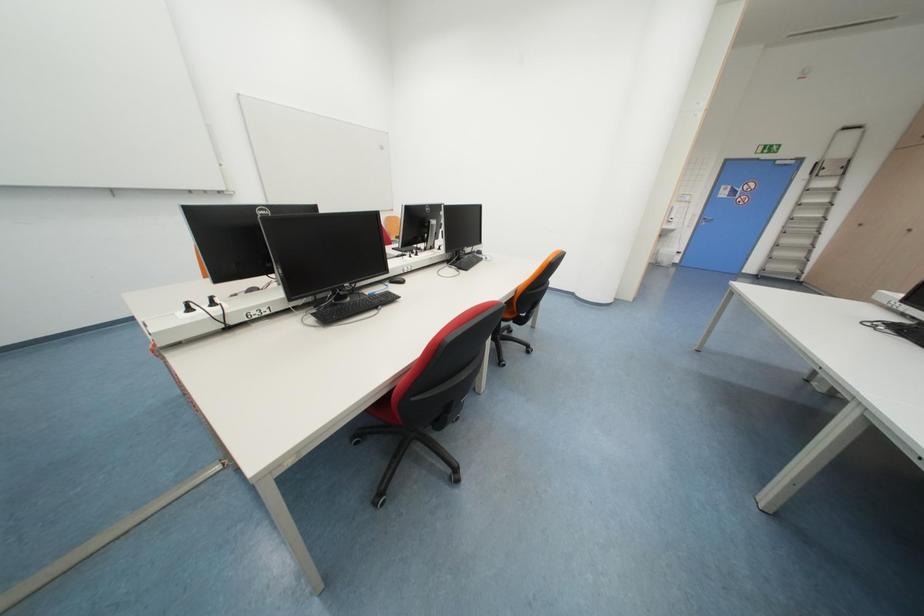
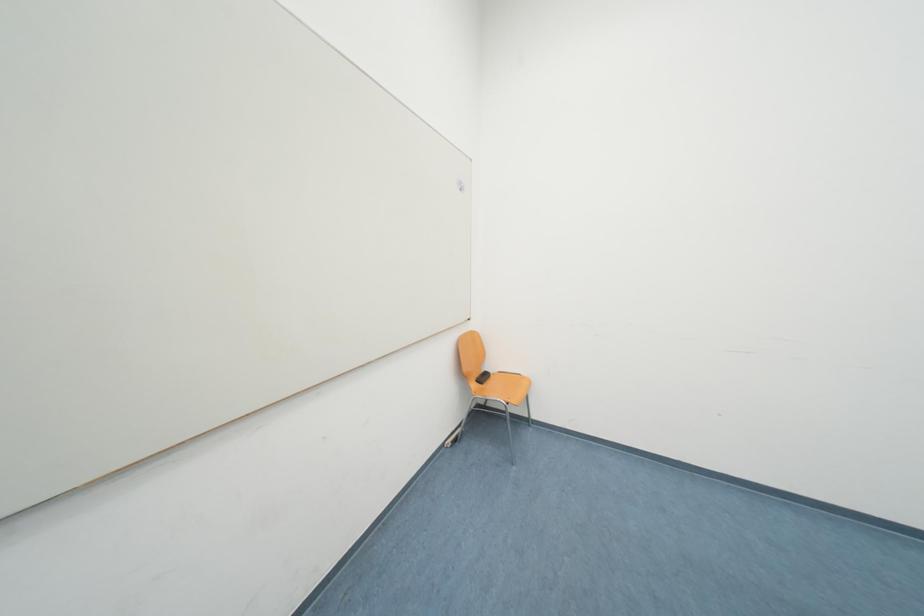
Which direction would the cameraman need to move to produce the second image?

The cameraman moved toward left, forward.